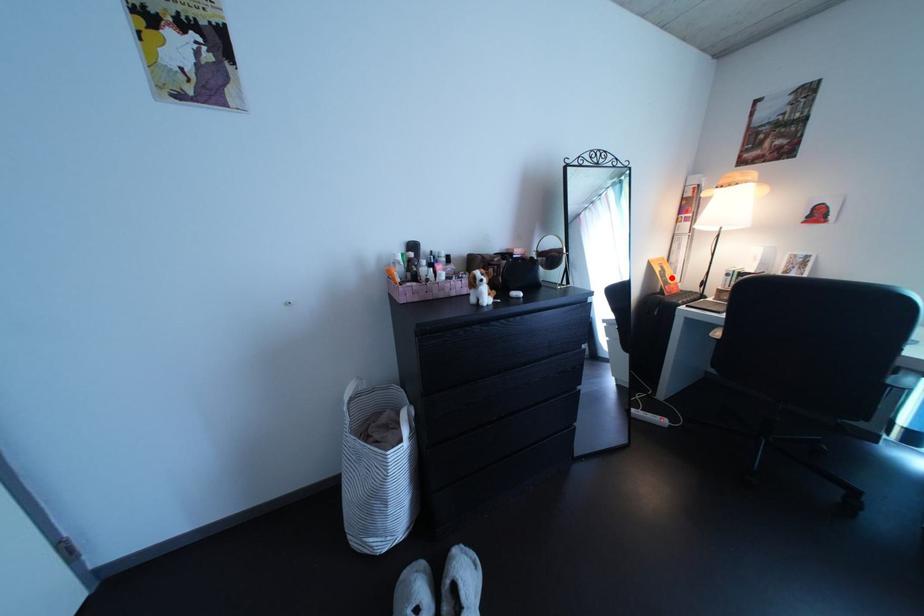
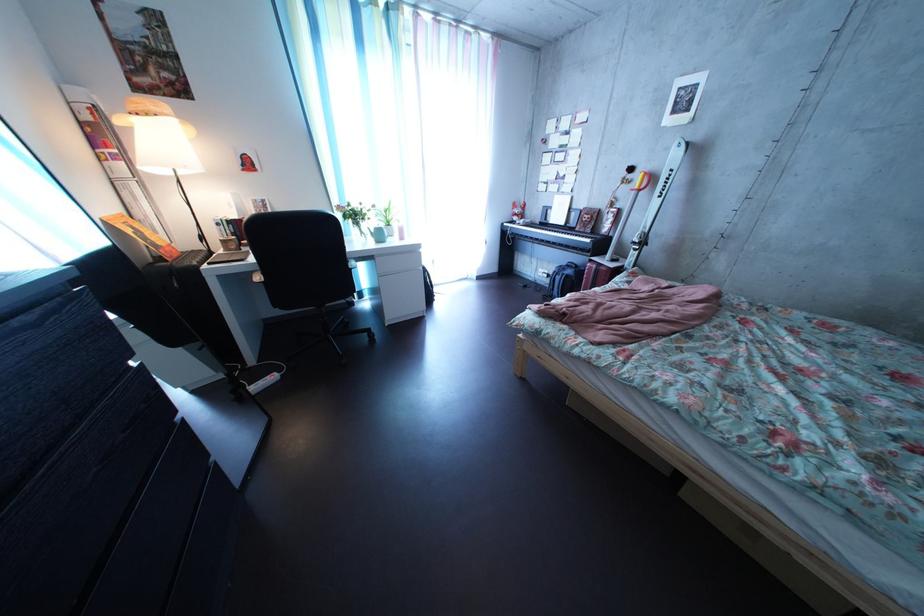
Find the pixel in the second image that matches the highlighted location in the first image.

(142, 238)